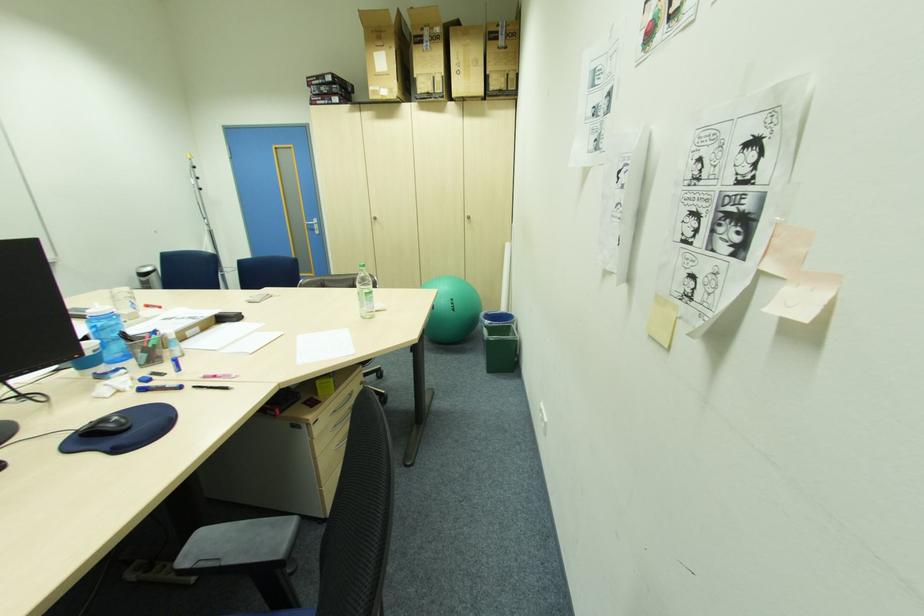
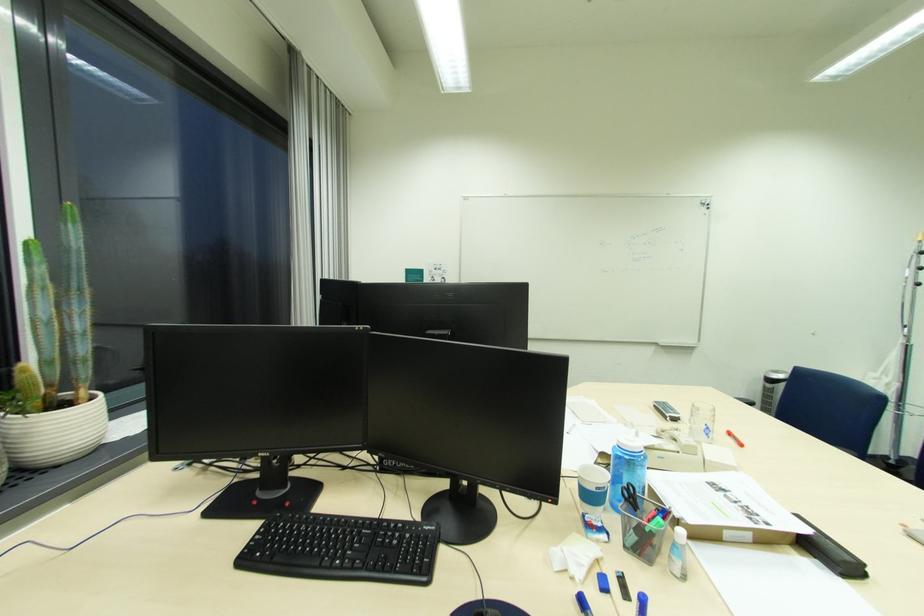
Where in the second image is the point corresponding to point (231, 323) from the first image?

(821, 557)